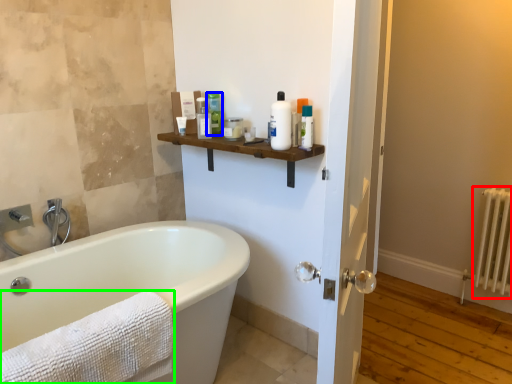
Question: Which object is positioned closest to radiator (highlighted by a red box)? Select from toiletry (highlighted by a blue box) and towel (highlighted by a green box).

Choices:
 (A) toiletry
 (B) towel

Answer: (A)